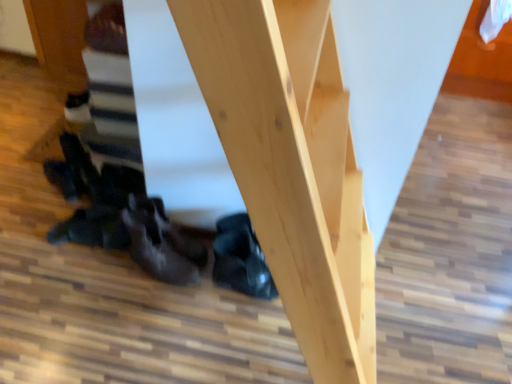
This screenshot has height=384, width=512. Identify the location of dark brown leather shoe at center, positioned as the first leather shoe in left-to-right order. point(158,255).

What is the approximate width of dark brown leather shoe at center, the 2th leather shoe in the right-to-left sequence?

It is 14.23 inches.

The height and width of the screenshot is (384, 512). What do you see at coordinates (158, 255) in the screenshot? I see `dark brown leather shoe at center, the 2th leather shoe in the right-to-left sequence` at bounding box center [158, 255].

Where is `black leather shoe at lower center, the second leather shoe viewed from the left`? black leather shoe at lower center, the second leather shoe viewed from the left is located at coordinates (241, 259).

Describe the element at coordinates (241, 259) in the screenshot. Image resolution: width=512 pixels, height=384 pixels. I see `black leather shoe at lower center, which is the 1th leather shoe in right-to-left order` at that location.

Measure the distance between point (249,255) and camera.

Point (249,255) is 5.33 feet away from camera.

At what (x,y) coordinates should I click in order to perform the action: click on dark brown leather shoe at center, the 2th leather shoe in the right-to-left sequence. Please return your answer as a coordinate pair (x, y). The width and height of the screenshot is (512, 384). Looking at the image, I should click on (158, 255).

Considering the relative positions of dark brown leather shoe at center, the 2th leather shoe in the right-to-left sequence, and black leather shoe at lower center, which is the 1th leather shoe in right-to-left order, in the image provided, is dark brown leather shoe at center, the 2th leather shoe in the right-to-left sequence, to the right of black leather shoe at lower center, which is the 1th leather shoe in right-to-left order, from the viewer's perspective?

No, dark brown leather shoe at center, the 2th leather shoe in the right-to-left sequence, is not to the right of black leather shoe at lower center, which is the 1th leather shoe in right-to-left order.

Is the depth of dark brown leather shoe at center, the 2th leather shoe in the right-to-left sequence, less than that of black leather shoe at lower center, which is the 1th leather shoe in right-to-left order?

Yes, it is.

Between point (146, 251) and point (230, 288), which one is positioned behind?

The point (230, 288) is farther from the camera.

From the image's perspective, relative to black leather shoe at lower center, the second leather shoe viewed from the left, is dark brown leather shoe at center, the 2th leather shoe in the right-to-left sequence, above or below?

dark brown leather shoe at center, the 2th leather shoe in the right-to-left sequence, is below black leather shoe at lower center, the second leather shoe viewed from the left.

From a real-world perspective, which object rests below the other?

In real-world perspective, black leather shoe at lower center, the second leather shoe viewed from the left, is lower.

In terms of width, does dark brown leather shoe at center, positioned as the first leather shoe in left-to-right order, look wider or thinner when compared to black leather shoe at lower center, which is the 1th leather shoe in right-to-left order?

In the image, dark brown leather shoe at center, positioned as the first leather shoe in left-to-right order, appears to be wider than black leather shoe at lower center, which is the 1th leather shoe in right-to-left order.

In terms of height, does dark brown leather shoe at center, positioned as the first leather shoe in left-to-right order, look taller or shorter compared to black leather shoe at lower center, which is the 1th leather shoe in right-to-left order?

Clearly, dark brown leather shoe at center, positioned as the first leather shoe in left-to-right order, is taller compared to black leather shoe at lower center, which is the 1th leather shoe in right-to-left order.

Who is bigger, dark brown leather shoe at center, positioned as the first leather shoe in left-to-right order, or black leather shoe at lower center, which is the 1th leather shoe in right-to-left order?

dark brown leather shoe at center, positioned as the first leather shoe in left-to-right order, is bigger.

Consider the image. Would you say dark brown leather shoe at center, the 2th leather shoe in the right-to-left sequence, is inside or outside black leather shoe at lower center, the second leather shoe viewed from the left?

dark brown leather shoe at center, the 2th leather shoe in the right-to-left sequence, is not enclosed by black leather shoe at lower center, the second leather shoe viewed from the left.

Are dark brown leather shoe at center, positioned as the first leather shoe in left-to-right order, and black leather shoe at lower center, which is the 1th leather shoe in right-to-left order, making contact?

No.

Is dark brown leather shoe at center, positioned as the first leather shoe in left-to-right order, aimed at black leather shoe at lower center, the second leather shoe viewed from the left?

No, dark brown leather shoe at center, positioned as the first leather shoe in left-to-right order, is not facing towards black leather shoe at lower center, the second leather shoe viewed from the left.

This screenshot has height=384, width=512. I want to click on leather shoe below the dark brown leather shoe at center, the 2th leather shoe in the right-to-left sequence (from a real-world perspective), so click(x=241, y=259).

In the image, is black leather shoe at lower center, the second leather shoe viewed from the left, on the left side or the right side of dark brown leather shoe at center, positioned as the first leather shoe in left-to-right order?

Based on their positions, black leather shoe at lower center, the second leather shoe viewed from the left, is located to the right of dark brown leather shoe at center, positioned as the first leather shoe in left-to-right order.

Which is in front, black leather shoe at lower center, the second leather shoe viewed from the left, or dark brown leather shoe at center, the 2th leather shoe in the right-to-left sequence?

dark brown leather shoe at center, the 2th leather shoe in the right-to-left sequence.

Considering the positions of points (254, 268) and (194, 278), is point (254, 268) closer to camera compared to point (194, 278)?

That is True.

From the image's perspective, is black leather shoe at lower center, the second leather shoe viewed from the left, above or below dark brown leather shoe at center, the 2th leather shoe in the right-to-left sequence?

black leather shoe at lower center, the second leather shoe viewed from the left, is above dark brown leather shoe at center, the 2th leather shoe in the right-to-left sequence.

From a real-world perspective, which is physically above, black leather shoe at lower center, the second leather shoe viewed from the left, or dark brown leather shoe at center, positioned as the first leather shoe in left-to-right order?

dark brown leather shoe at center, positioned as the first leather shoe in left-to-right order, from a real-world perspective.

Considering the sizes of objects black leather shoe at lower center, which is the 1th leather shoe in right-to-left order, and dark brown leather shoe at center, the 2th leather shoe in the right-to-left sequence, in the image provided, who is wider, black leather shoe at lower center, which is the 1th leather shoe in right-to-left order, or dark brown leather shoe at center, the 2th leather shoe in the right-to-left sequence,?

Wider between the two is dark brown leather shoe at center, the 2th leather shoe in the right-to-left sequence.

From their relative heights in the image, would you say black leather shoe at lower center, which is the 1th leather shoe in right-to-left order, is taller or shorter than dark brown leather shoe at center, the 2th leather shoe in the right-to-left sequence?

black leather shoe at lower center, which is the 1th leather shoe in right-to-left order, is shorter than dark brown leather shoe at center, the 2th leather shoe in the right-to-left sequence.

Can you confirm if black leather shoe at lower center, the second leather shoe viewed from the left, is smaller than dark brown leather shoe at center, positioned as the first leather shoe in left-to-right order?

Yes, black leather shoe at lower center, the second leather shoe viewed from the left, is smaller than dark brown leather shoe at center, positioned as the first leather shoe in left-to-right order.

Can we say black leather shoe at lower center, which is the 1th leather shoe in right-to-left order, lies outside dark brown leather shoe at center, positioned as the first leather shoe in left-to-right order?

That's correct, black leather shoe at lower center, which is the 1th leather shoe in right-to-left order, is outside of dark brown leather shoe at center, positioned as the first leather shoe in left-to-right order.

Is black leather shoe at lower center, which is the 1th leather shoe in right-to-left order, beside dark brown leather shoe at center, positioned as the first leather shoe in left-to-right order?

black leather shoe at lower center, which is the 1th leather shoe in right-to-left order, is not next to dark brown leather shoe at center, positioned as the first leather shoe in left-to-right order, and they're not touching.

Is black leather shoe at lower center, which is the 1th leather shoe in right-to-left order, facing towards dark brown leather shoe at center, positioned as the first leather shoe in left-to-right order?

No, black leather shoe at lower center, which is the 1th leather shoe in right-to-left order, is not oriented towards dark brown leather shoe at center, positioned as the first leather shoe in left-to-right order.

Could you measure the distance between black leather shoe at lower center, which is the 1th leather shoe in right-to-left order, and dark brown leather shoe at center, positioned as the first leather shoe in left-to-right order?

The distance of black leather shoe at lower center, which is the 1th leather shoe in right-to-left order, from dark brown leather shoe at center, positioned as the first leather shoe in left-to-right order, is 8.19 inches.

I want to click on leather shoe on the right side of dark brown leather shoe at center, positioned as the first leather shoe in left-to-right order, so click(x=241, y=259).

Locate an element on the screen. This screenshot has width=512, height=384. leather shoe below the dark brown leather shoe at center, positioned as the first leather shoe in left-to-right order (from a real-world perspective) is located at coordinates (241, 259).

Where is `leather shoe on the left side of black leather shoe at lower center, which is the 1th leather shoe in right-to-left order`? This screenshot has height=384, width=512. leather shoe on the left side of black leather shoe at lower center, which is the 1th leather shoe in right-to-left order is located at coordinates (158, 255).